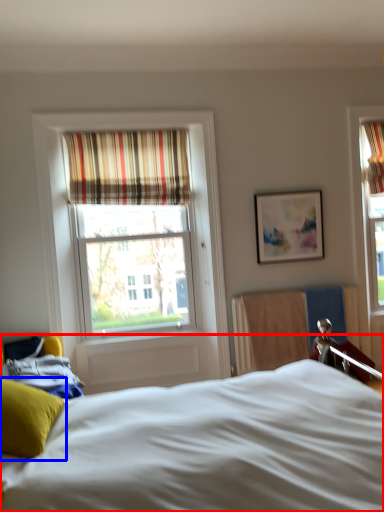
Question: Which point is further to the camera, bed (highlighted by a red box) or pillow (highlighted by a blue box)?

Choices:
 (A) bed
 (B) pillow

Answer: (B)